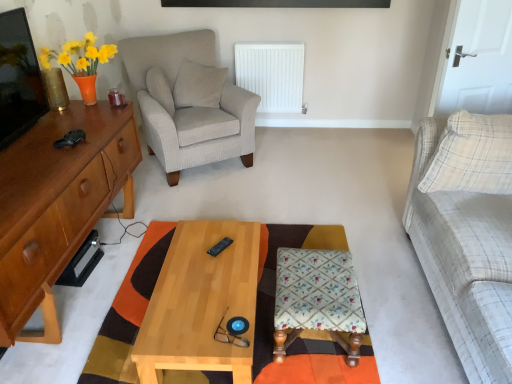
Where is `vacant position to the left of plaid fabric couch at right`? The height and width of the screenshot is (384, 512). vacant position to the left of plaid fabric couch at right is located at coordinates (360, 289).